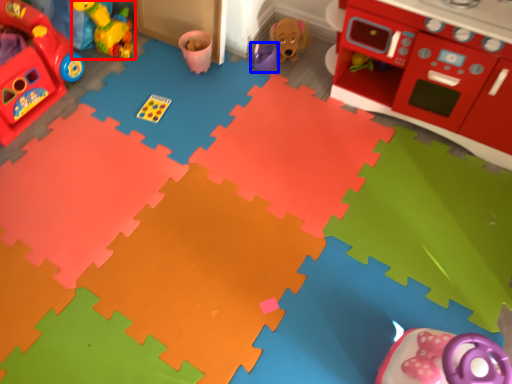
Question: Which object appears closest to the camera in this image, toy (highlighted by a red box) or toy (highlighted by a blue box)?

Choices:
 (A) toy
 (B) toy

Answer: (A)